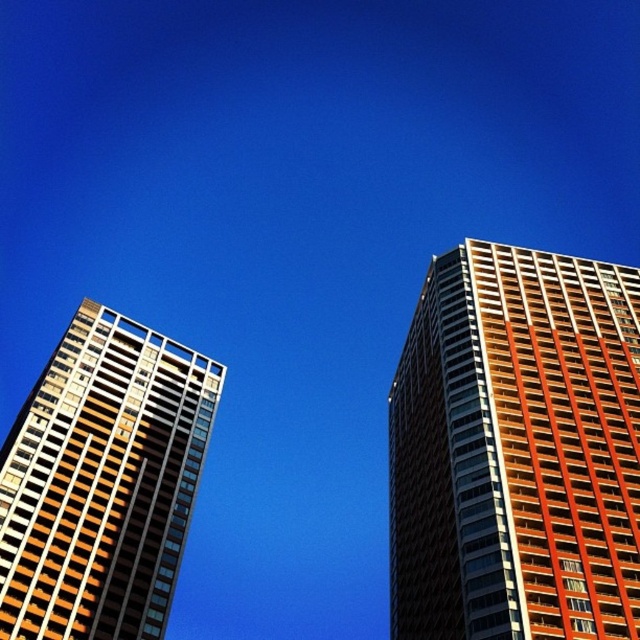
You are a drone operator who needs to deliver a package to the orange glass building at right. Your current position is at point (x=516, y=451). Can you confirm if you are already above the orange glass building at right?

Yes, the point (x=516, y=451) corresponds to the orange glass building at right, so you are already above the orange glass building at right.

You are a photographer standing in a park across from the two buildings. You want to take a photo of the matte glass building at left without the orange glass building at right blocking it. Is this possible given their current positions?

The orange glass building at right is in front of the matte glass building at left, so it is blocking the view. Therefore, it is not possible to take a photo of the matte glass building at left without the orange glass building at right blocking it from your current position.